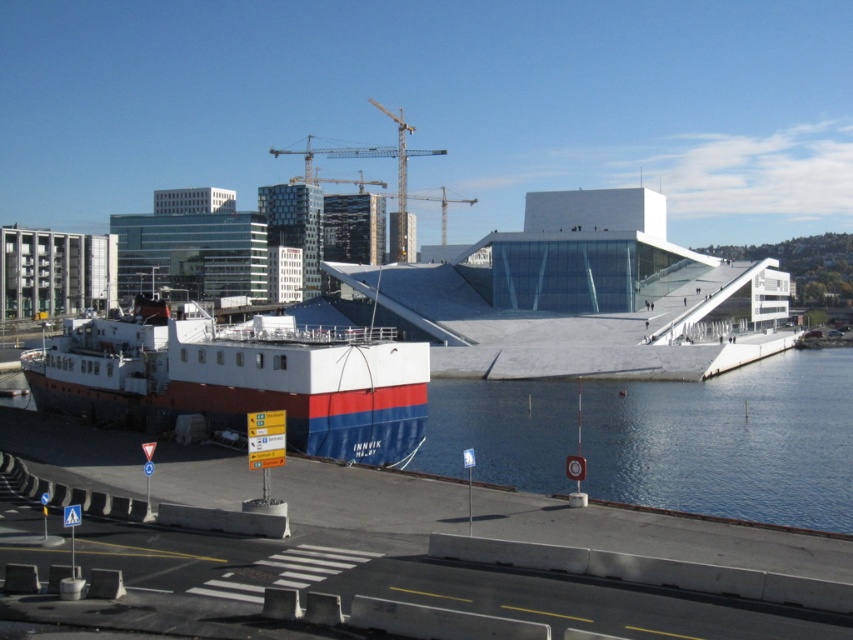
You are a drone operator trying to capture a photo of the Oslo Opera House from above. Your drone is currently hovering at point coordinates of 0.5, 0.5. The white matte boat at lower left is at point 0.592, 0.284. To avoid collision with the boat, you need to adjust your drone to a safe altitude. What is the minimum vertical distance your drone must ascend to ensure it stays above the boat?

The minimum vertical distance the drone must ascend is the difference in the y coordinates. The boat is at y 0.284 and the drone is at y 0.5. Subtracting 0.284 from 0.5 gives 0.216. Therefore, the drone must ascend at least 0.216 units vertically to stay above the boat.

You are standing on the pier and want to take a photo of both the white matte boat at lower left and the metallic yellow crane at upper center in the same frame. Can you position yourself so that neither object blocks the other?

Yes, you can position yourself so that neither the white matte boat at lower left nor the metallic yellow crane at upper center blocks the other because the white matte boat at lower left is in front of the metallic yellow crane at upper center, allowing you to angle the camera to include both without obstruction.